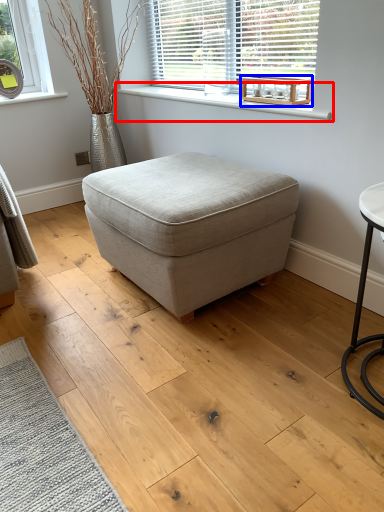
Question: Which object is closer to the camera taking this photo, window sill (highlighted by a red box) or round table (highlighted by a blue box)?

Choices:
 (A) window sill
 (B) round table

Answer: (A)